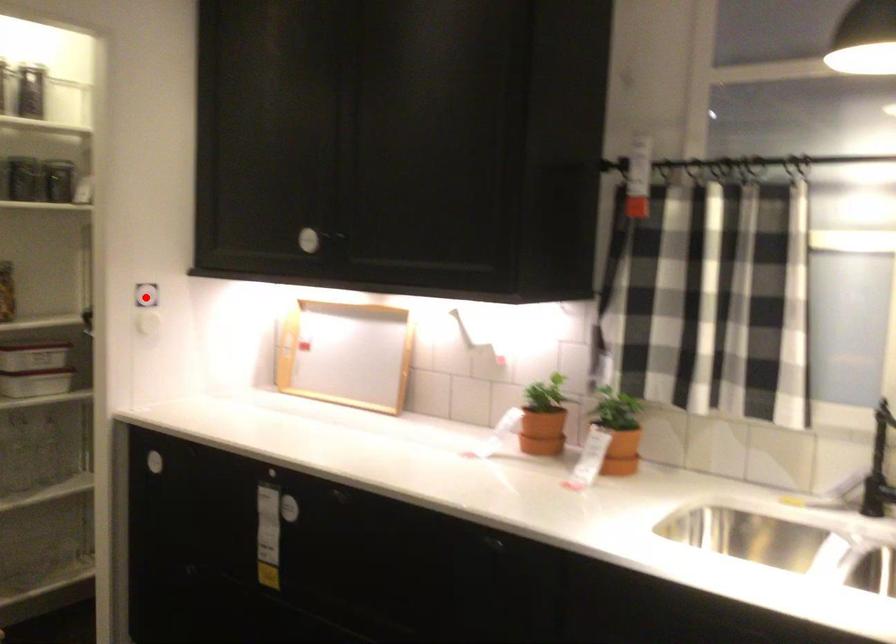
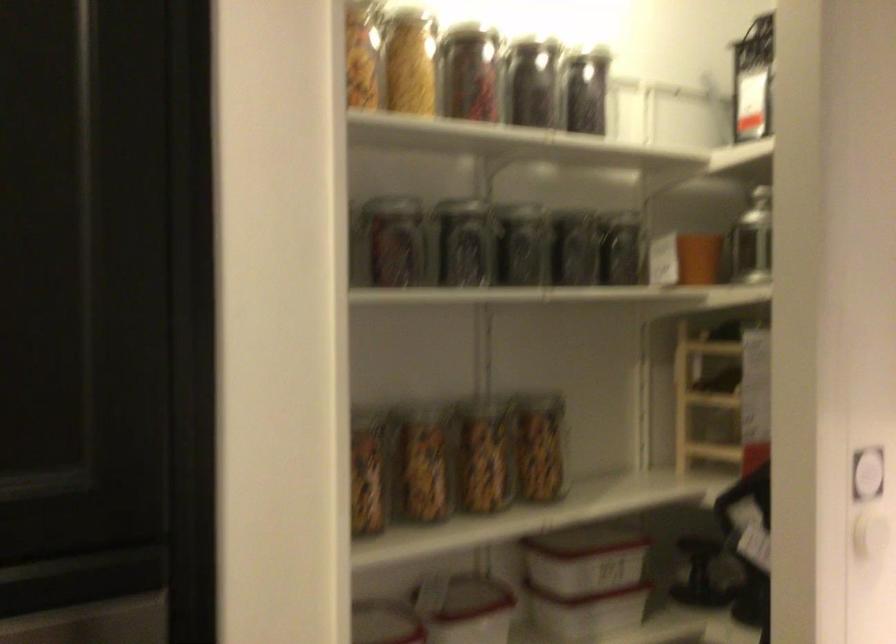
The point at the highlighted location is marked in the first image. Where is the corresponding point in the second image?

(867, 474)